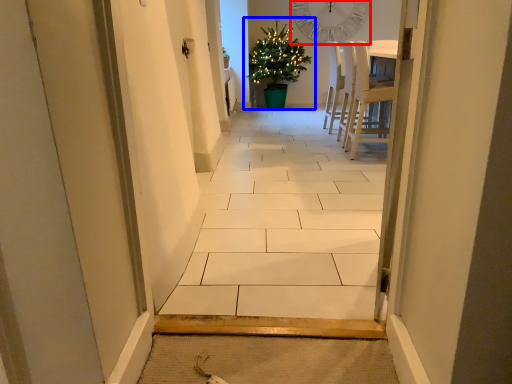
Question: Which object is closer to the camera taking this photo, clock (highlighted by a red box) or houseplant (highlighted by a blue box)?

Choices:
 (A) clock
 (B) houseplant

Answer: (B)